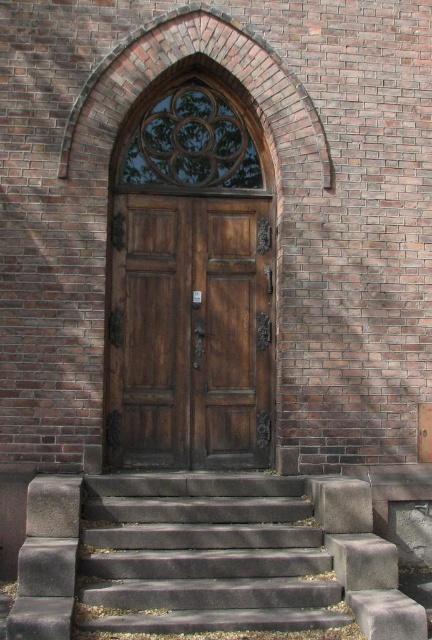
Between polished wood door at center and gray concrete stairs at lower center, which one is positioned lower?

Positioned lower is gray concrete stairs at lower center.

Does polished wood door at center have a lesser height compared to gray concrete stairs at lower center?

In fact, polished wood door at center may be taller than gray concrete stairs at lower center.

Does point (216, 348) come in front of point (44, 564)?

No, (216, 348) is behind (44, 564).

This screenshot has width=432, height=640. In order to click on polished wood door at center in this screenshot , I will do `click(190, 332)`.